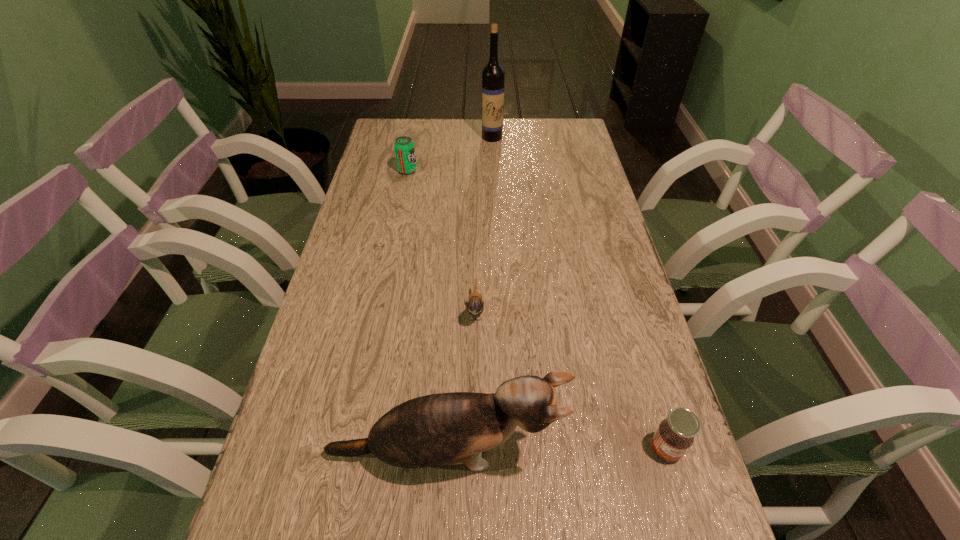
Image resolution: width=960 pixels, height=540 pixels. Find the location of `the farthest object`. the farthest object is located at coordinates (493, 75).

You are a GUI agent. You are given a task and a screenshot of the screen. Output one action in this format:
    pyautogui.click(x=<x>, y=<y>)
    Task: Click on the tallest object
    Image resolution: width=960 pixels, height=540 pixels.
    Given the screenshot: What is the action you would take?
    pyautogui.click(x=493, y=75)

Locate an element on the screen. This screenshot has height=540, width=960. cat is located at coordinates (453, 428).

Locate an element on the screen. The height and width of the screenshot is (540, 960). pop soda is located at coordinates (404, 147).

Locate an element on the screen. jam is located at coordinates (674, 436).

Locate an element on the screen. The width and height of the screenshot is (960, 540). kitten is located at coordinates (475, 305).

Where is `the shortest object`? The height and width of the screenshot is (540, 960). the shortest object is located at coordinates (475, 305).

Where is `vacant space located 0.170m on the label of the wine bottle`? vacant space located 0.170m on the label of the wine bottle is located at coordinates (493, 169).

Locate an element on the screen. vacant area situated 0.170m at the face of the cat is located at coordinates (655, 454).

Find the location of a particular element. vacant space located on the front-facing side of the pop soda is located at coordinates (532, 171).